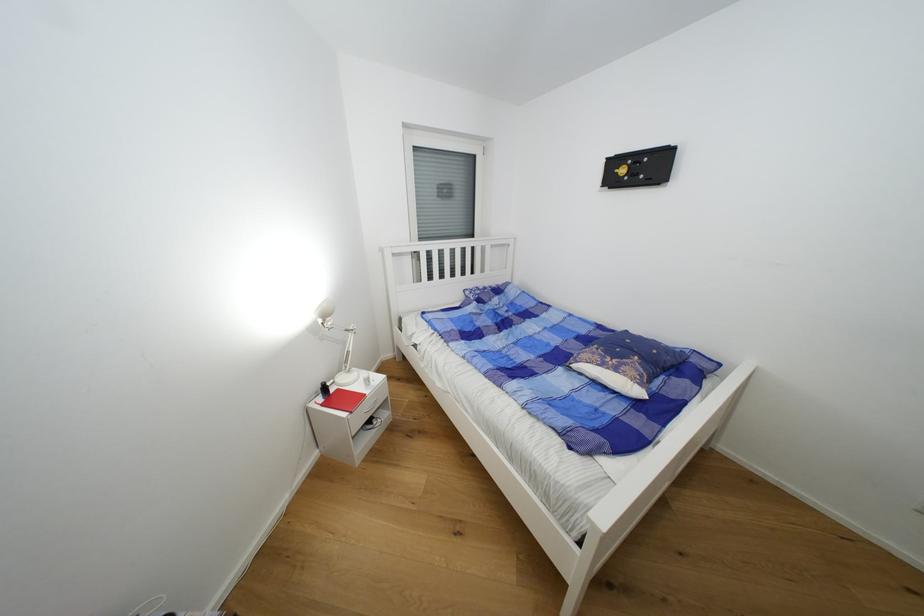
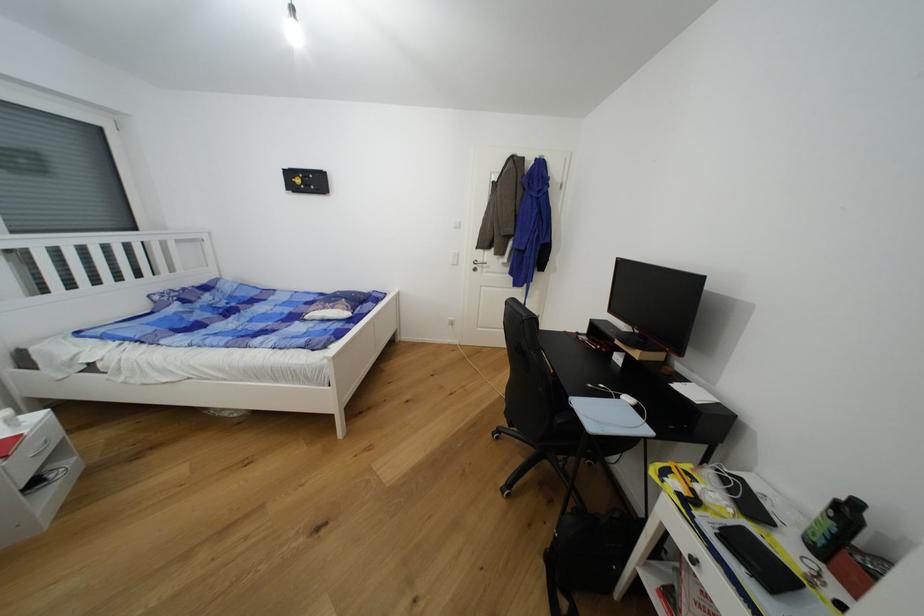
In the second image, find the point that corresponds to point 472,294 in the first image.

(162, 299)